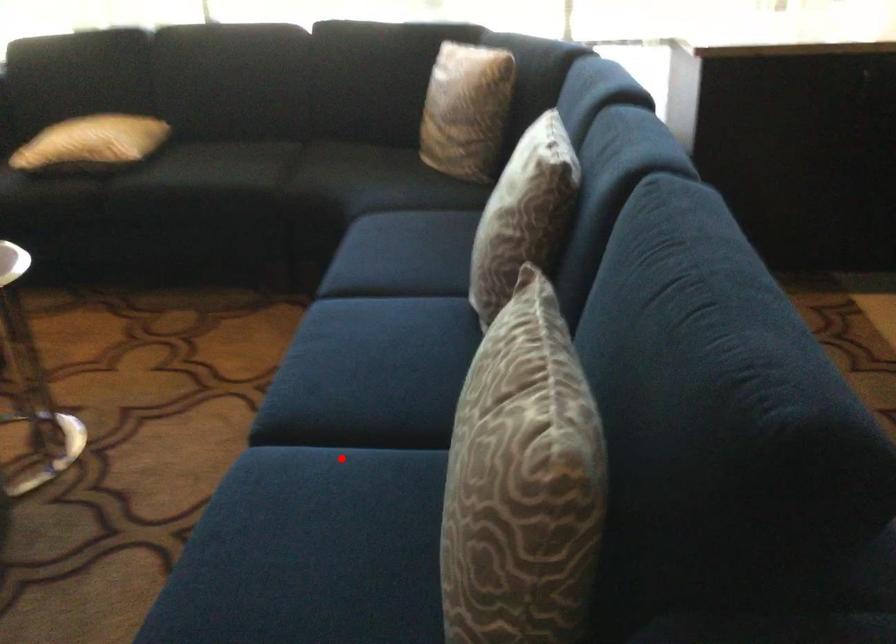
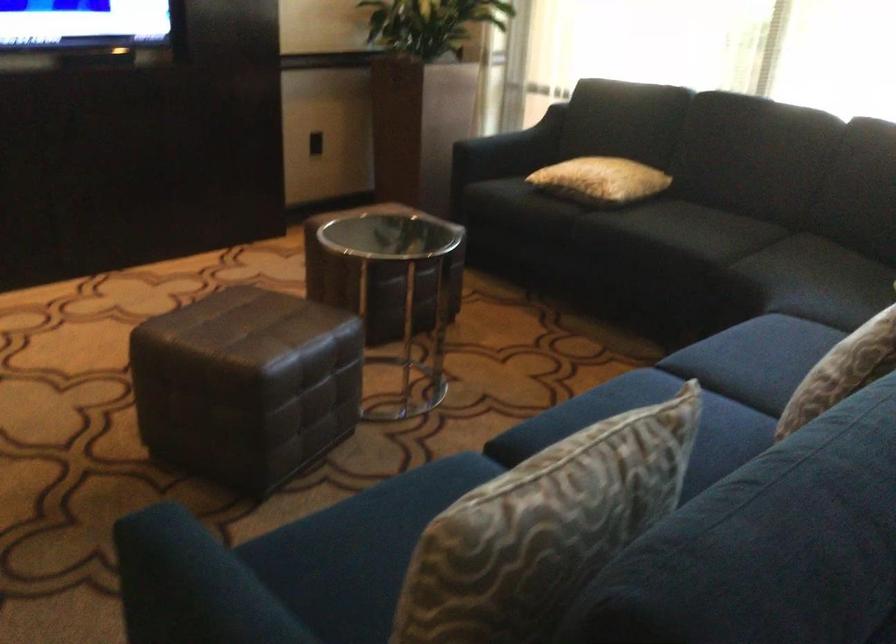
Question: I am providing you with two images of the same scene from different viewpoints. A red point is marked on the first image. Is the red point's position out of view in image 2?

Choices:
 (A) Yes
 (B) No

Answer: (A)